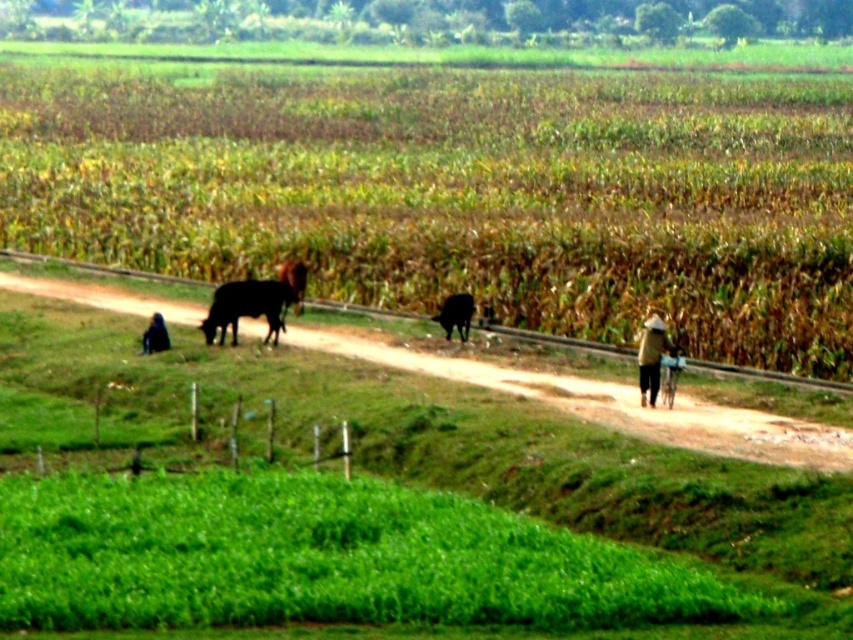
Find the location of a particular element. This screenshot has height=640, width=853. brown grassy corn field at center is located at coordinates [463, 195].

Who is taller, brown grassy corn field at center or light brown woven hat at right?

Standing taller between the two is brown grassy corn field at center.

Between point (339, 106) and point (666, 344), which one is positioned in front?

Point (666, 344) is more forward.

Locate an element on the screen. This screenshot has height=640, width=853. brown grassy corn field at center is located at coordinates coord(463,195).

Who is more distant from viewer, (x=236, y=308) or (x=155, y=312)?

The point (x=155, y=312) is more distant.

Does point (227, 320) come in front of point (160, 332)?

No.

This screenshot has height=640, width=853. In order to click on black glossy cow at left in this screenshot , I will do `click(248, 307)`.

Does black glossy cow at left have a larger size compared to light brown woven hat at right?

Yes, black glossy cow at left is bigger than light brown woven hat at right.

Which is in front, point (206, 333) or point (666, 340)?

Point (666, 340) is in front.

What do you see at coordinates (248, 307) in the screenshot?
I see `black glossy cow at left` at bounding box center [248, 307].

Locate an element on the screen. black glossy cow at left is located at coordinates (248, 307).